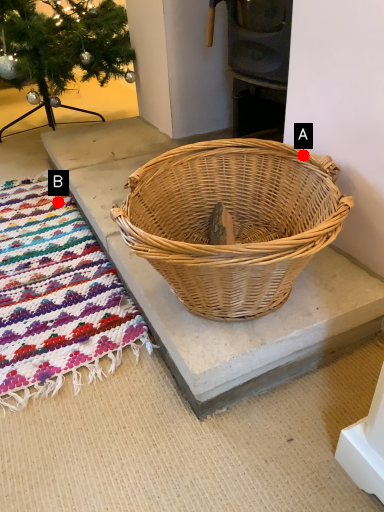
Question: Two points are circled on the image, labeled by A and B beside each circle. Which point is closer to the camera?

Choices:
 (A) A is closer
 (B) B is closer

Answer: (A)